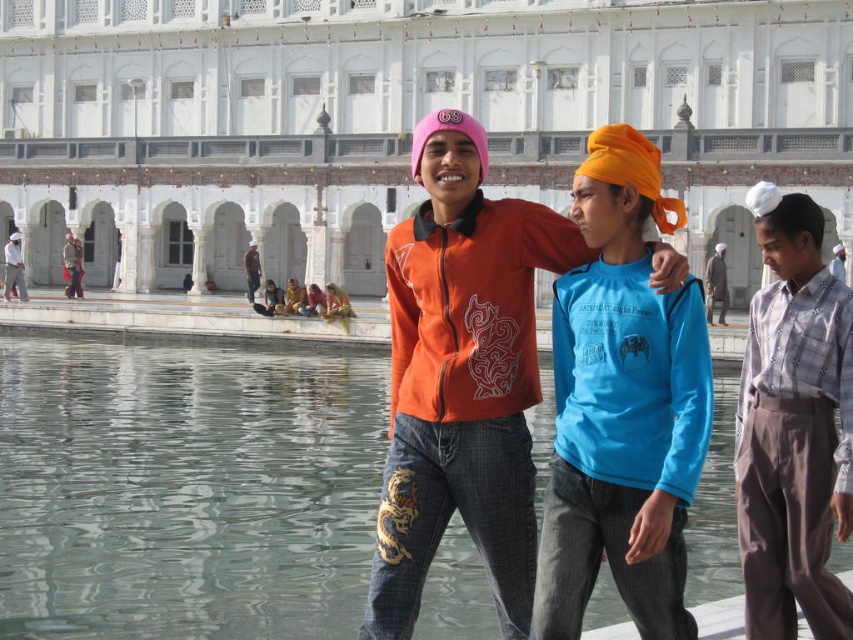
You are standing at point (836, 253) and want to walk to point (271, 314). Is the path between these two points clear of any obstacles?

The path between point (271, 314) and point (836, 253) is clear since point (271, 314) is behind point (836, 253), implying no obstruction between them.